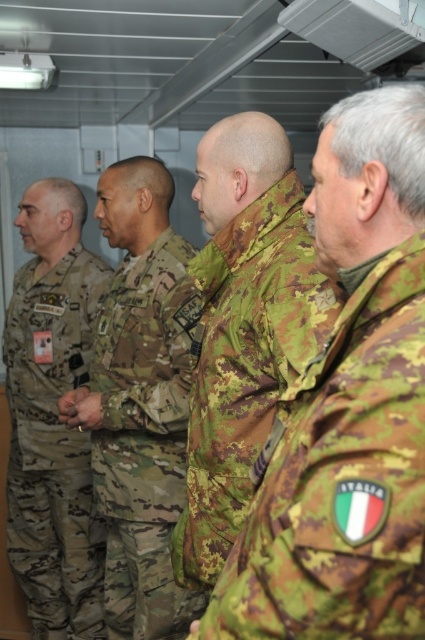
Is camouflage uniform at center bigger than camouflage fabric jacket at center?

Indeed, camouflage uniform at center has a larger size compared to camouflage fabric jacket at center.

Who is lower down, camouflage uniform at center or camouflage fabric jacket at center?

camouflage uniform at center

Is point (164, 339) closer to viewer compared to point (272, 276)?

No.

This screenshot has height=640, width=425. I want to click on camouflage uniform at center, so click(x=139, y=403).

Is camouflage fabric jacket at center thinner than camouflage uniform at left?

Indeed, camouflage fabric jacket at center has a lesser width compared to camouflage uniform at left.

Is camouflage fabric jacket at center shorter than camouflage uniform at left?

Yes, camouflage fabric jacket at center is shorter than camouflage uniform at left.

In order to click on camouflage fabric jacket at center in this screenshot , I will do `click(237, 326)`.

The height and width of the screenshot is (640, 425). Find the location of `camouflage uniform at center`. camouflage uniform at center is located at coordinates (139, 403).

Is point (127, 378) less distant than point (11, 412)?

Yes, point (127, 378) is in front of point (11, 412).

The image size is (425, 640). Find the location of `camouflage uniform at center`. camouflage uniform at center is located at coordinates (139, 403).